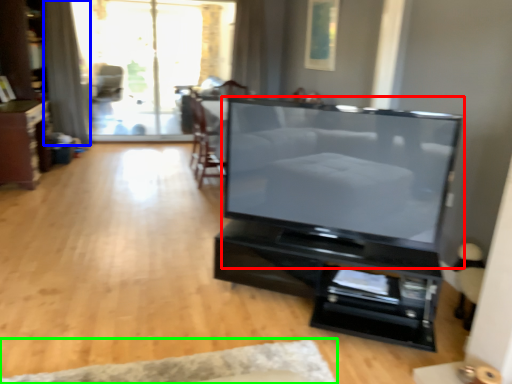
Question: Estimate the real-world distances between objects in this image. Which object is farther from television (highlighted by a red box), curtain (highlighted by a blue box) or plain (highlighted by a green box)?

Choices:
 (A) curtain
 (B) plain

Answer: (A)